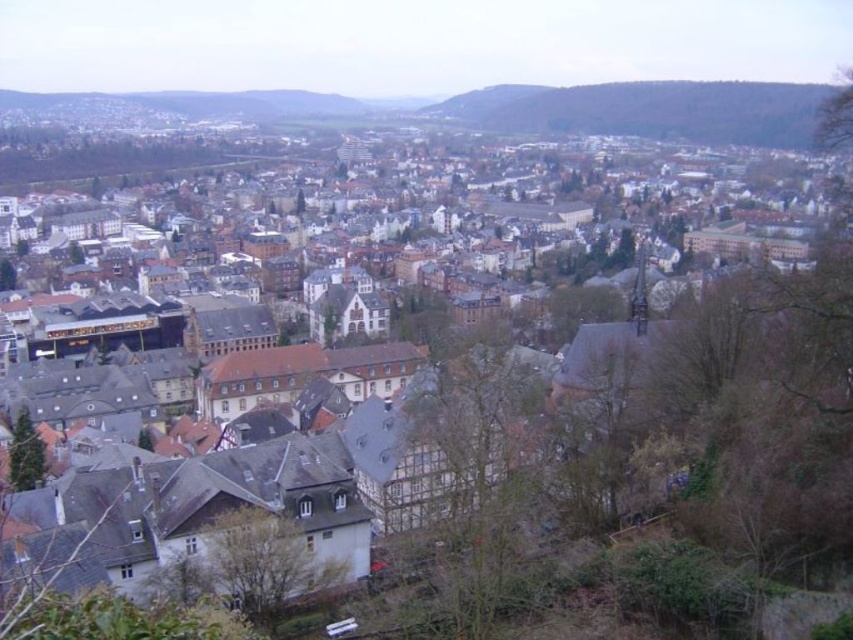
Question: Which point is closer to the camera taking this photo?

Choices:
 (A) 306,563
 (B) 645,132
 (C) 16,445
 (D) 529,474

Answer: (A)

Question: Is green matte tree at lower left bigger than green leafy tree at lower left?

Choices:
 (A) no
 (B) yes

Answer: (B)

Question: Can you confirm if green leafy tree at upper right is positioned below green leafy tree at lower left?

Choices:
 (A) no
 (B) yes

Answer: (A)

Question: Which of the following is the farthest from the observer?

Choices:
 (A) (233, 541)
 (B) (833, 108)
 (C) (0, 289)
 (D) (447, 108)

Answer: (D)

Question: Which of these objects is positioned farthest from the green leafy tree at upper right?

Choices:
 (A) green leafy tree at lower center
 (B) green matte tree at lower left
 (C) green grassy hillside at upper right
 (D) green leafy tree at lower left

Answer: (C)

Question: Is green leafy tree at upper right bigger than green leafy tree at lower left?

Choices:
 (A) yes
 (B) no

Answer: (A)